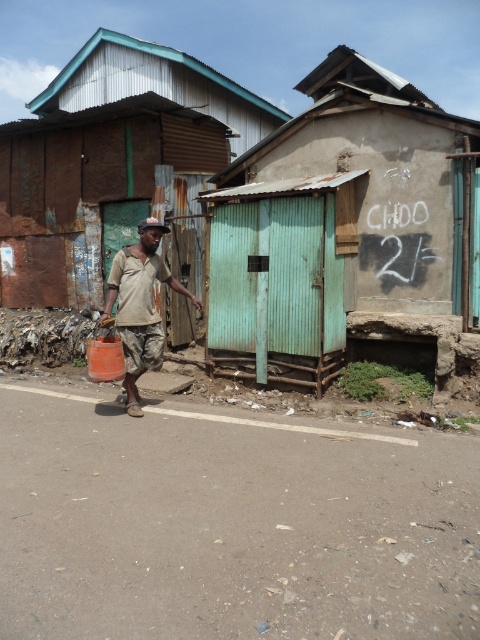
Question: Can you confirm if green corrugated metal hut at center is wider than rusty corrugated metal hut at center?

Choices:
 (A) yes
 (B) no

Answer: (B)

Question: Which object is closer to the camera taking this photo?

Choices:
 (A) camouflage pants at center
 (B) green corrugated metal hut at center

Answer: (A)

Question: Can you confirm if rusty corrugated metal hut at center is smaller than camouflage pants at center?

Choices:
 (A) no
 (B) yes

Answer: (A)

Question: Which object is the closest to the camouflage pants at center?

Choices:
 (A) rusty corrugated metal hut at center
 (B) green corrugated metal hut at center

Answer: (B)

Question: Which point is closer to the camera?

Choices:
 (A) rusty corrugated metal hut at center
 (B) camouflage pants at center
 (C) green corrugated metal hut at center

Answer: (B)

Question: Can you confirm if rusty corrugated metal hut at center is thinner than camouflage pants at center?

Choices:
 (A) no
 (B) yes

Answer: (A)